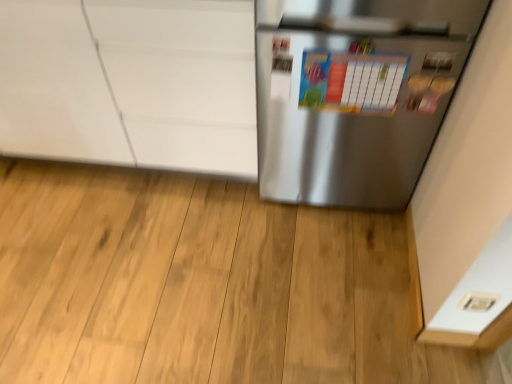
Question: From a real-world perspective, is white glossy cabinet at upper left on top of colorful paperboard at center?

Choices:
 (A) no
 (B) yes

Answer: (A)

Question: Is colorful paperboard at center completely or partially inside white glossy cabinet at upper left?

Choices:
 (A) no
 (B) yes

Answer: (A)

Question: Is white glossy cabinet at upper left next to colorful paperboard at center?

Choices:
 (A) yes
 (B) no

Answer: (B)

Question: Does white glossy cabinet at upper left turn towards colorful paperboard at center?

Choices:
 (A) no
 (B) yes

Answer: (A)

Question: Considering the relative sizes of white glossy cabinet at upper left and colorful paperboard at center in the image provided, is white glossy cabinet at upper left bigger than colorful paperboard at center?

Choices:
 (A) yes
 (B) no

Answer: (A)

Question: Visually, is white glossy cabinet at upper left positioned to the left or to the right of white plastic electric outlet at lower right?

Choices:
 (A) right
 (B) left

Answer: (B)

Question: Is white glossy cabinet at upper left in front of or behind white plastic electric outlet at lower right in the image?

Choices:
 (A) front
 (B) behind

Answer: (B)

Question: Is white glossy cabinet at upper left wider or thinner than white plastic electric outlet at lower right?

Choices:
 (A) thin
 (B) wide

Answer: (B)

Question: From a real-world perspective, relative to white plastic electric outlet at lower right, is white glossy cabinet at upper left vertically above or below?

Choices:
 (A) below
 (B) above

Answer: (B)

Question: From a real-world perspective, is colorful paperboard at center above or below satin silver refrigerator at right?

Choices:
 (A) below
 (B) above

Answer: (B)

Question: Considering the positions of colorful paperboard at center and satin silver refrigerator at right in the image, is colorful paperboard at center wider or thinner than satin silver refrigerator at right?

Choices:
 (A) wide
 (B) thin

Answer: (B)

Question: Would you say colorful paperboard at center is to the left or to the right of satin silver refrigerator at right in the picture?

Choices:
 (A) right
 (B) left

Answer: (B)

Question: Is colorful paperboard at center taller or shorter than satin silver refrigerator at right?

Choices:
 (A) short
 (B) tall

Answer: (A)

Question: Considering the positions of point (487, 304) and point (362, 100), is point (487, 304) closer or farther from the camera than point (362, 100)?

Choices:
 (A) farther
 (B) closer

Answer: (B)

Question: In terms of size, does white plastic electric outlet at lower right appear bigger or smaller than colorful paperboard at center?

Choices:
 (A) small
 (B) big

Answer: (A)